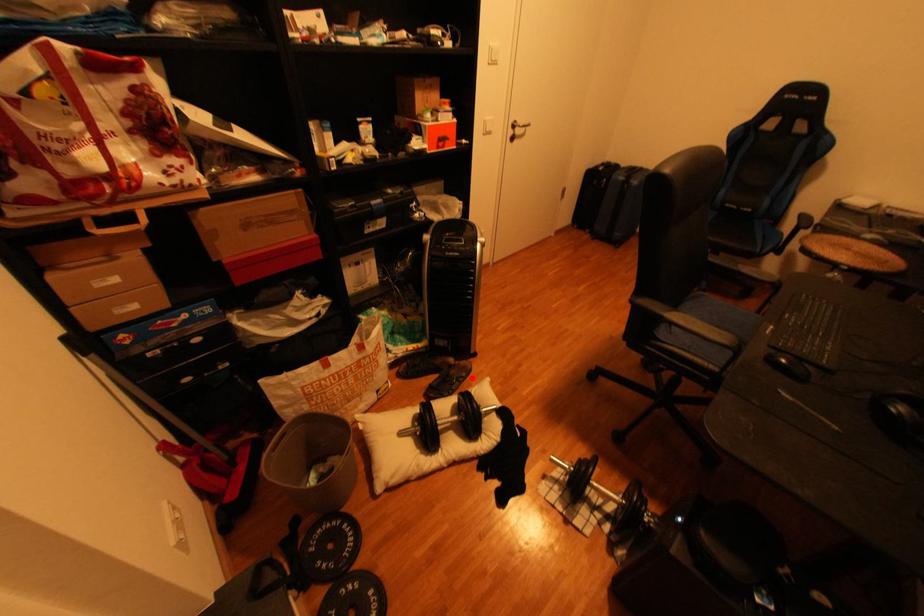
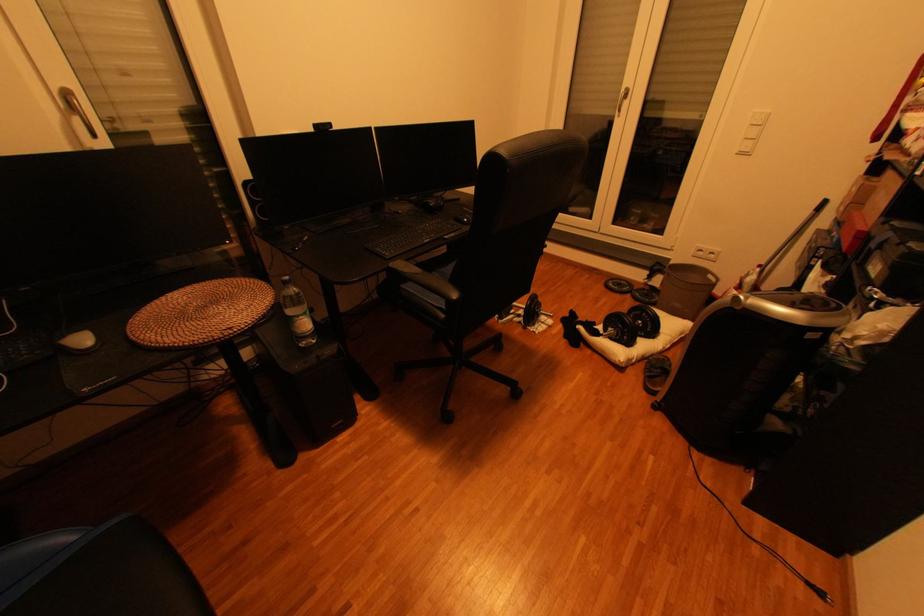
In the second image, find the point that corresponds to the highlighted location in the first image.

(658, 373)